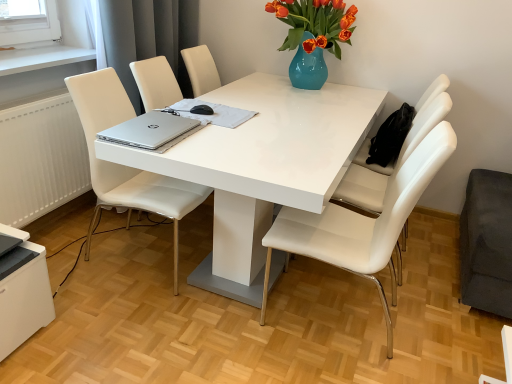
Locate an element on the screen. This screenshot has height=384, width=512. unoccupied region to the right of silver metallic laptop at center is located at coordinates (212, 140).